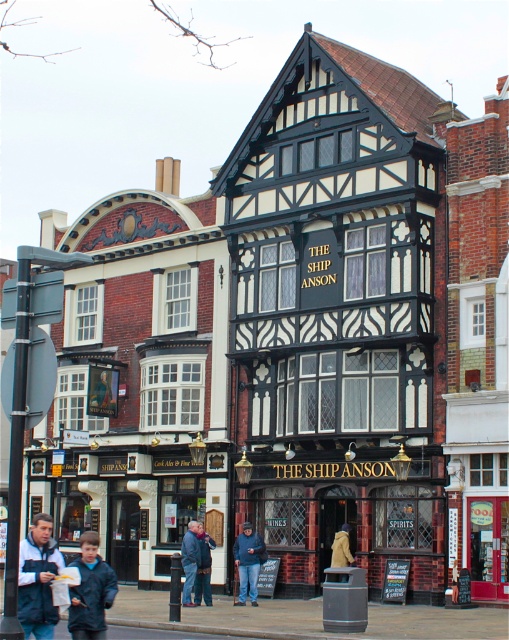
Question: Does matte black pub at center come behind golden statue at center?

Choices:
 (A) yes
 (B) no

Answer: (B)

Question: Which of the following is the farthest from the observer?

Choices:
 (A) dark blue jacket at lower left
 (B) blue fleece jacket at lower left
 (C) golden statue at center

Answer: (C)

Question: Does blue denim jeans at lower center have a lesser width compared to golden statue at center?

Choices:
 (A) no
 (B) yes

Answer: (A)

Question: Which point is closer to the camera?

Choices:
 (A) blue fleece jacket at lower left
 (B) blue denim jeans at lower center
 (C) blue denim jacket at lower center

Answer: (A)

Question: Considering the real-world distances, which object is closest to the dark blue jeans at center?

Choices:
 (A) blue denim jeans at lower center
 (B) dark blue jacket at lower left
 (C) blue fleece jacket at lower left
 (D) golden statue at center

Answer: (A)

Question: Can you confirm if blue fleece jacket at lower left is thinner than dark blue jeans at center?

Choices:
 (A) no
 (B) yes

Answer: (A)